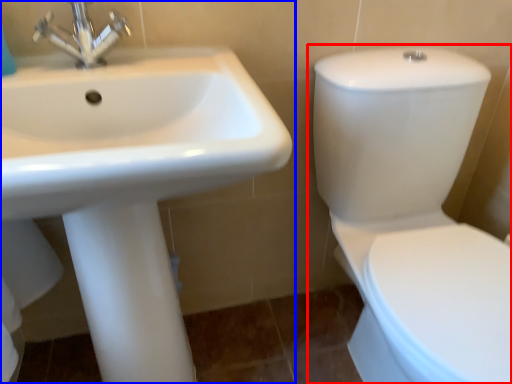
Question: Which point is closer to the camera, toilet (highlighted by a red box) or sink (highlighted by a blue box)?

Choices:
 (A) toilet
 (B) sink

Answer: (A)